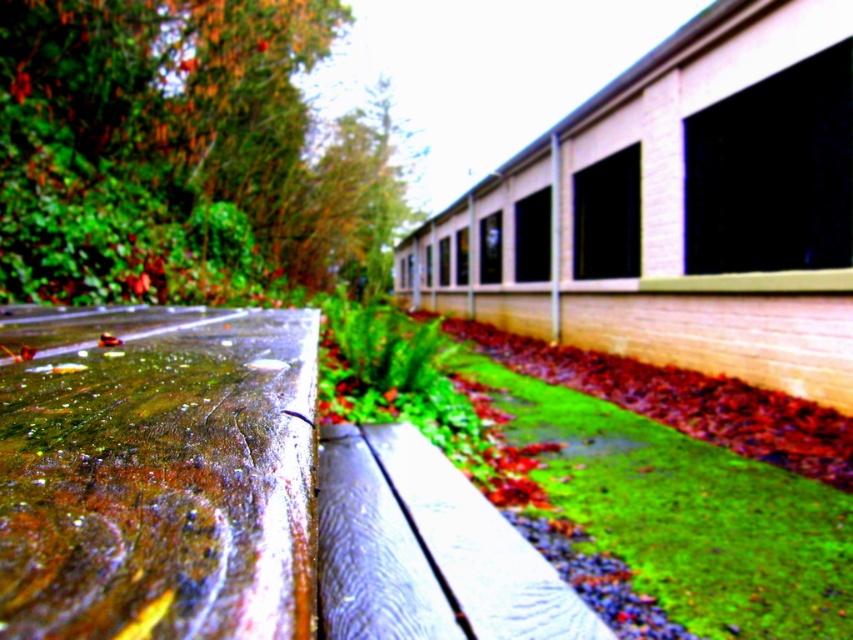
Question: Does wet wood bench at lower left have a larger size compared to green mossy grass at lower right?

Choices:
 (A) no
 (B) yes

Answer: (B)

Question: Which object appears closest to the camera in this image?

Choices:
 (A) green mossy grass at lower right
 (B) wet wood bench at lower left

Answer: (B)

Question: Which point appears closest to the camera in this image?

Choices:
 (A) (743, 506)
 (B) (289, 436)

Answer: (B)

Question: Considering the relative positions of wet wood bench at lower left and green mossy grass at lower right in the image provided, where is wet wood bench at lower left located with respect to green mossy grass at lower right?

Choices:
 (A) above
 (B) below

Answer: (A)

Question: Where is wet wood bench at lower left located in relation to green mossy grass at lower right in the image?

Choices:
 (A) below
 (B) above

Answer: (B)

Question: Which point is closer to the camera?

Choices:
 (A) wet wood bench at lower left
 (B) green mossy grass at lower right

Answer: (A)